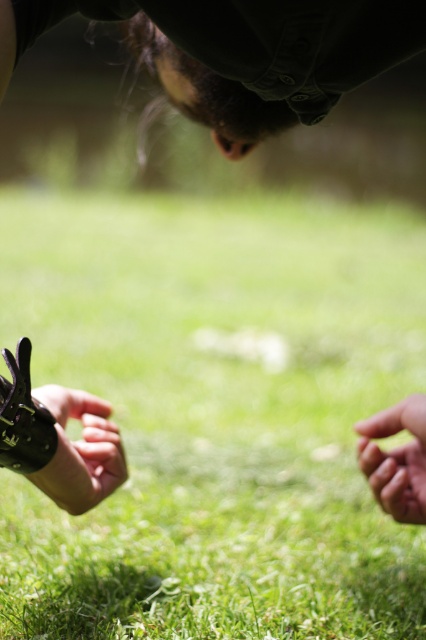
Question: Which point is farther to the camera?

Choices:
 (A) [60, 392]
 (B) [134, 388]
 (C) [385, 512]

Answer: (B)

Question: Which object is the farthest from the smooth skin hand at lower right?

Choices:
 (A) green grass at center
 (B) black matte glove at lower left

Answer: (A)

Question: Among these objects, which one is nearest to the camera?

Choices:
 (A) green grass at center
 (B) smooth skin hand at lower right

Answer: (B)

Question: Can you confirm if green grass at center is smaller than black matte glove at lower left?

Choices:
 (A) no
 (B) yes

Answer: (A)

Question: Can you confirm if green grass at center is positioned below smooth skin hand at lower right?

Choices:
 (A) yes
 (B) no

Answer: (B)

Question: Does black matte glove at lower left appear on the right side of smooth skin hand at lower right?

Choices:
 (A) yes
 (B) no

Answer: (B)